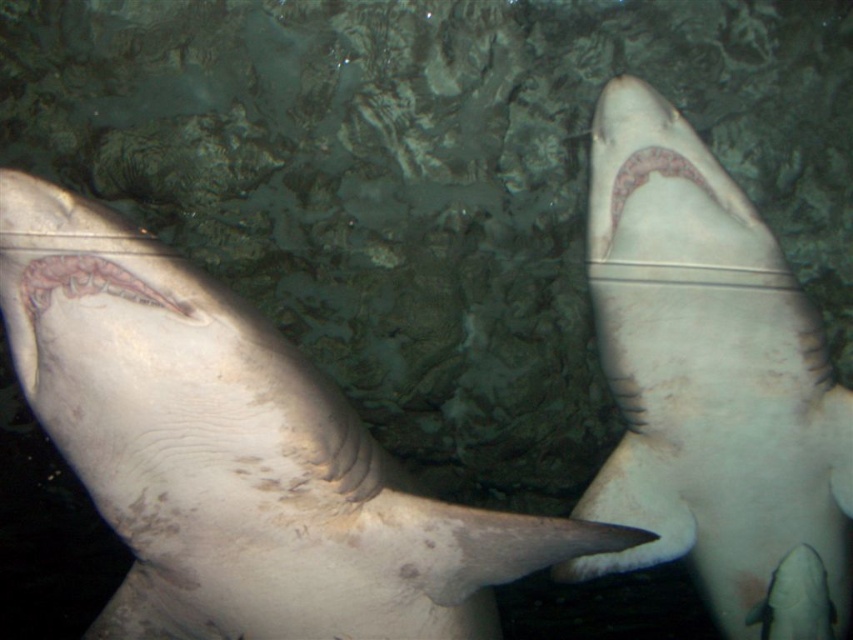
Consider the image. You are a marine biologist observing two sharks in an aquarium tank. You notice a smooth gray shark at center and a smooth white shark at upper right. Based on their positions, which shark is closer to the bottom of the tank?

The smooth gray shark at center is positioned under the smooth white shark at upper right, so it is closer to the bottom of the tank.

You are a marine biologist preparing to take measurements of the smooth white shark at upper right. Your measuring tape can extend up to 6 feet. Can you reach the shark with your tape measure?

The smooth white shark at upper right is 6.54 feet away from the viewer, which is beyond the 6 feet limit of the measuring tape. Therefore, the tape measure cannot reach the shark.